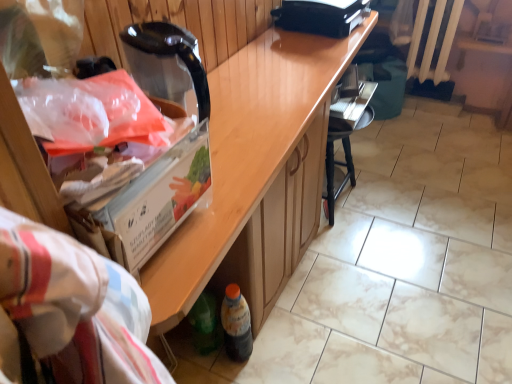
The width and height of the screenshot is (512, 384). I want to click on vacant area that is in front of black plastic printer at upper center, so click(x=304, y=59).